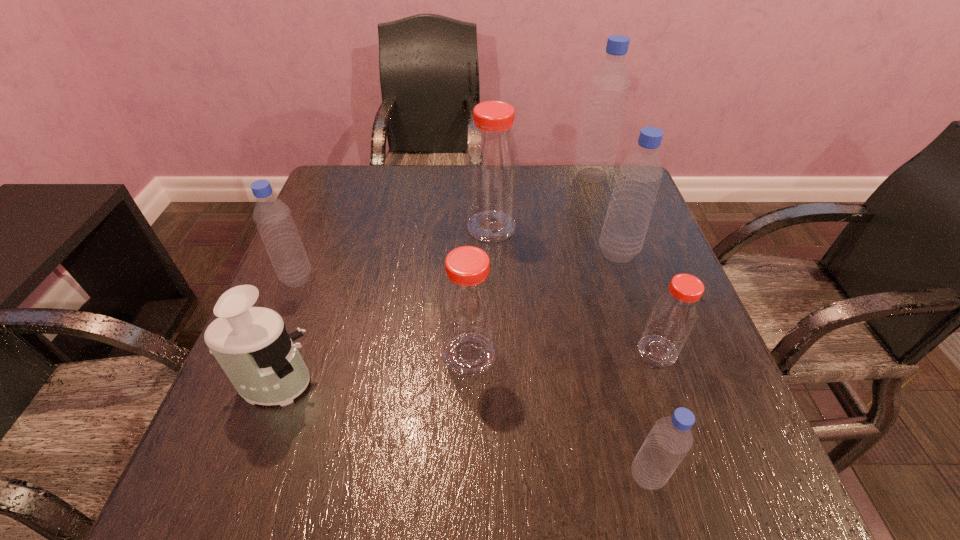
Where is `the farthest object`? the farthest object is located at coordinates (609, 87).

What are the coordinates of `the tallest object` in the screenshot? It's located at (609, 87).

Find the location of `the biggest red bottle`. the biggest red bottle is located at coordinates (492, 163).

Locate an element on the screen. the second biggest blue bottle is located at coordinates (640, 174).

I want to click on the third biggest blue bottle, so click(x=273, y=218).

This screenshot has height=540, width=960. I want to click on the leftmost blue bottle, so click(273, 218).

This screenshot has width=960, height=540. Find the location of `the second smallest red bottle`. the second smallest red bottle is located at coordinates (468, 303).

Find the location of a particular element. Image resolution: width=960 pixels, height=540 pixels. juicer is located at coordinates (251, 344).

Find the location of a particular element. This screenshot has height=540, width=960. the smallest red bottle is located at coordinates (675, 312).

Where is `the smallest blue bottle`? The width and height of the screenshot is (960, 540). the smallest blue bottle is located at coordinates (670, 439).